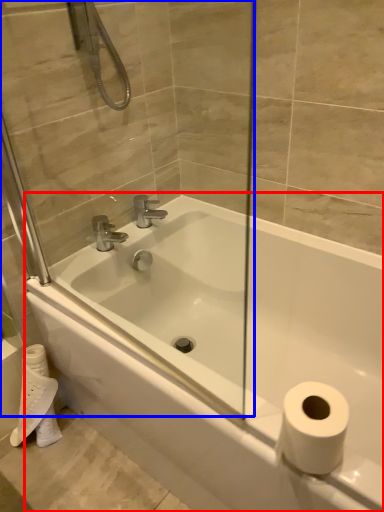
Question: Which of the following is the closest to the observer, bathtub (highlighted by a red box) or glass door (highlighted by a blue box)?

Choices:
 (A) bathtub
 (B) glass door

Answer: (B)